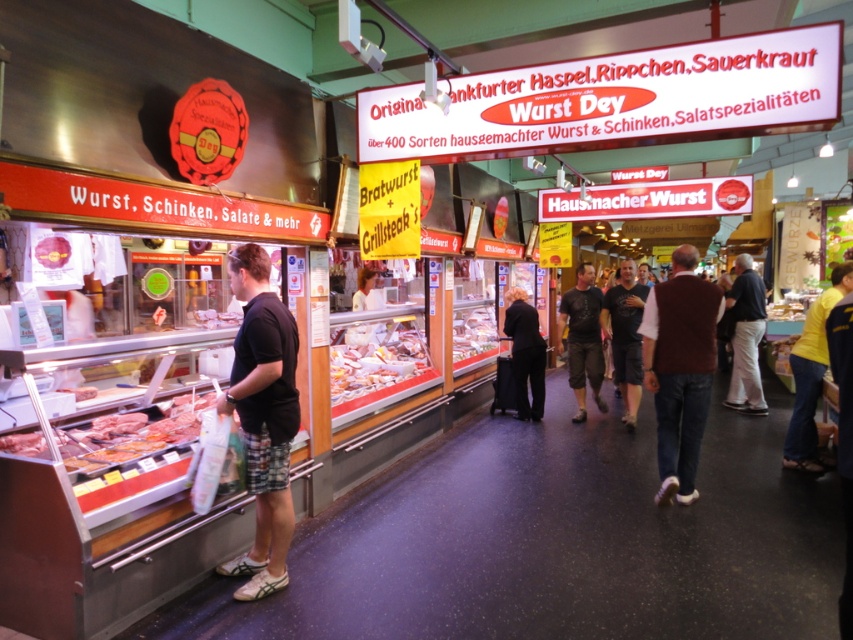
Question: In this image, where is raw meat at lower left located relative to black cotton t-shirt at center?

Choices:
 (A) above
 (B) below

Answer: (B)

Question: Does yellow cotton shirt at right appear on the right side of dark brown t-shirt at center?

Choices:
 (A) yes
 (B) no

Answer: (A)

Question: Based on their relative distances, which object is nearer to the matte plastic deli meat at center?

Choices:
 (A) black cotton t-shirt at center
 (B) shiny plastic meat at center
 (C) dark brown shirt at center

Answer: (B)

Question: Which point is farther to the camera?

Choices:
 (A) click(x=409, y=372)
 (B) click(x=735, y=284)
 (C) click(x=846, y=291)

Answer: (B)

Question: Which point is farther to the camera?

Choices:
 (A) raw meat at lower left
 (B) matte plastic deli meat at center

Answer: (B)

Question: Does shiny plastic meat at center have a larger size compared to matte plastic deli meat at center?

Choices:
 (A) yes
 (B) no

Answer: (A)